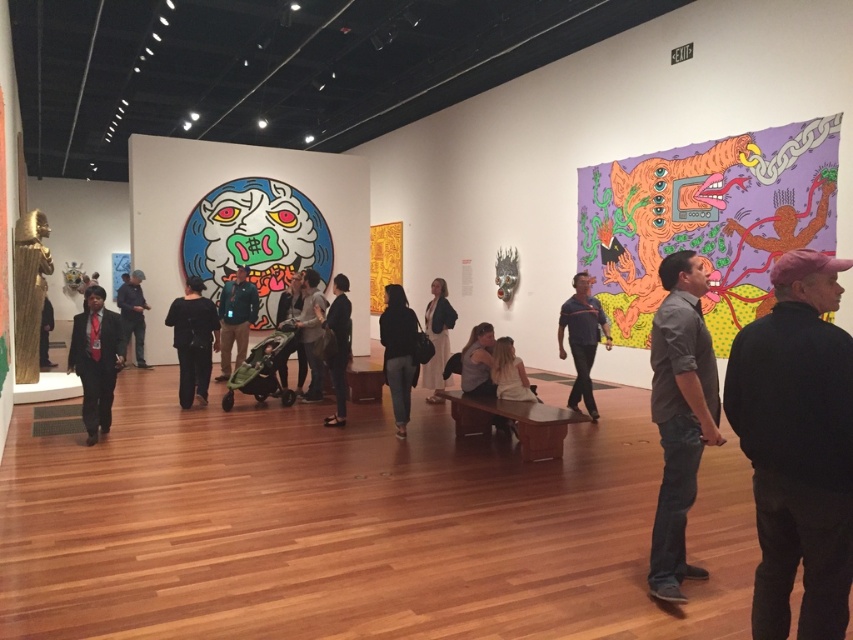
Consider the image. Is gray cotton shirt at center to the right of blue fabric shirt at center from the viewer's perspective?

In fact, gray cotton shirt at center is to the left of blue fabric shirt at center.

Which is below, gray cotton shirt at center or blue fabric shirt at center?

gray cotton shirt at center is lower down.

Does point (682, 304) come farther from viewer compared to point (585, 403)?

No, it is not.

At what (x,y) coordinates should I click in order to perform the action: click on gray cotton shirt at center. Please return your answer as a coordinate pair (x, y). This screenshot has height=640, width=853. Looking at the image, I should click on (679, 416).

Does black matte pants at center appear over light gray cotton shirt at center?

Incorrect, black matte pants at center is not positioned above light gray cotton shirt at center.

Between black matte pants at center and light gray cotton shirt at center, which one has more height?

light gray cotton shirt at center is taller.

Does point (189, 308) lie behind point (318, 371)?

No, (189, 308) is in front of (318, 371).

You are a GUI agent. You are given a task and a screenshot of the screen. Output one action in this format:
    pyautogui.click(x=<x>, y=<y>)
    Task: Click on the black matte pants at center
    
    Given the screenshot: What is the action you would take?
    pyautogui.click(x=193, y=340)

Between black fabric jacket at right and dark gray suit at center, which one is positioned lower?

Positioned lower is black fabric jacket at right.

Which is behind, point (804, 394) or point (325, 417)?

The point (325, 417) is behind.

At what (x,y) coordinates should I click in order to perform the action: click on black fabric jacket at right. Please return your answer as a coordinate pair (x, y). Looking at the image, I should click on (798, 445).